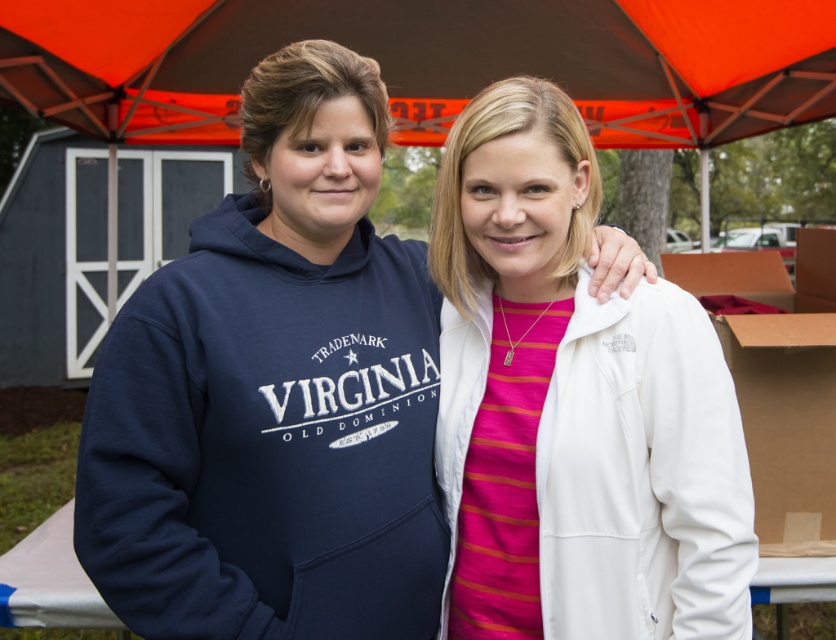
You are a photographer adjusting your camera settings. You have two points of interest in the image, point (268, 205) and point (401, 122). Which point is closer to your camera lens?

Point (268, 205) is closer to the camera lens than point (401, 122).

You are a photographer trying to capture both the navy fleece sweatshirt at center and the white fleece sweatshirt at center in a single shot. Which sweatshirt might block the view of the other?

The navy fleece sweatshirt at center is positioned over the white fleece sweatshirt at center, so it might block the view of the white fleece sweatshirt at center.

You are a photographer setting up for an event. You need to adjust the camera angle so that the navy blue hoodie at left and orange fabric canopy at upper center are both in frame. Considering their heights, which object should be placed closer to the camera to ensure both are fully visible?

The navy blue hoodie at left is taller than the orange fabric canopy at upper center, so to ensure both are fully visible, the navy blue hoodie at left should be placed closer to the camera.